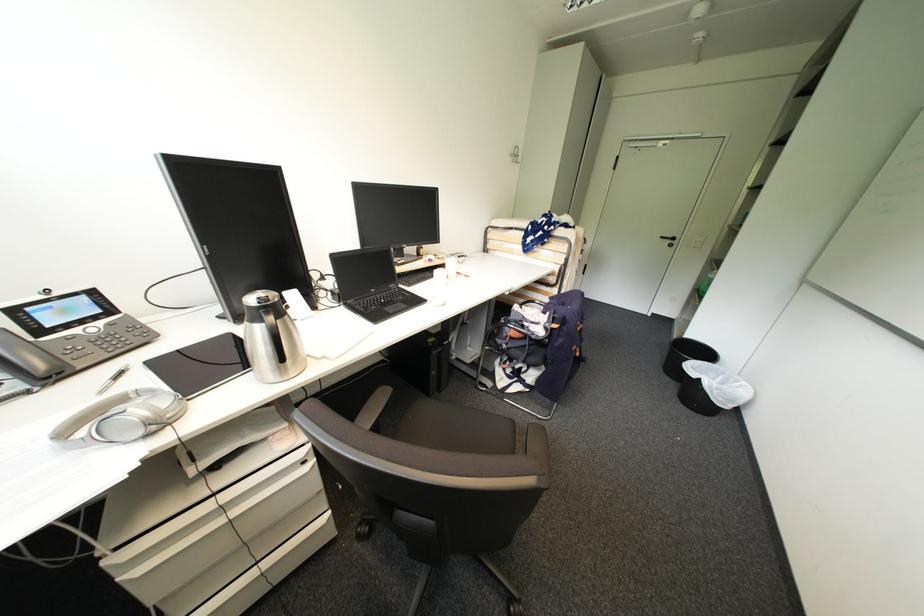
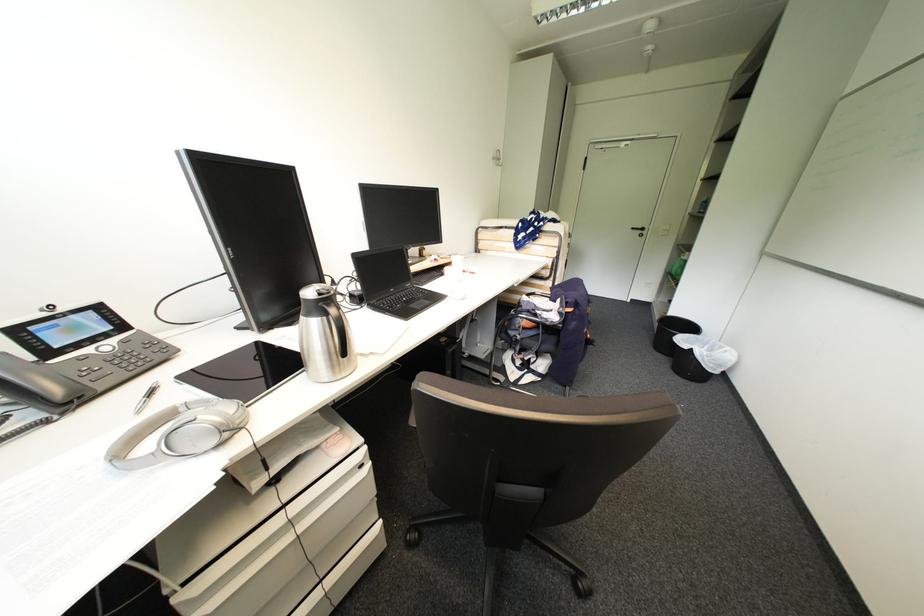
Find the pixel in the second image that matches (x=165, y=408) in the first image.

(235, 415)